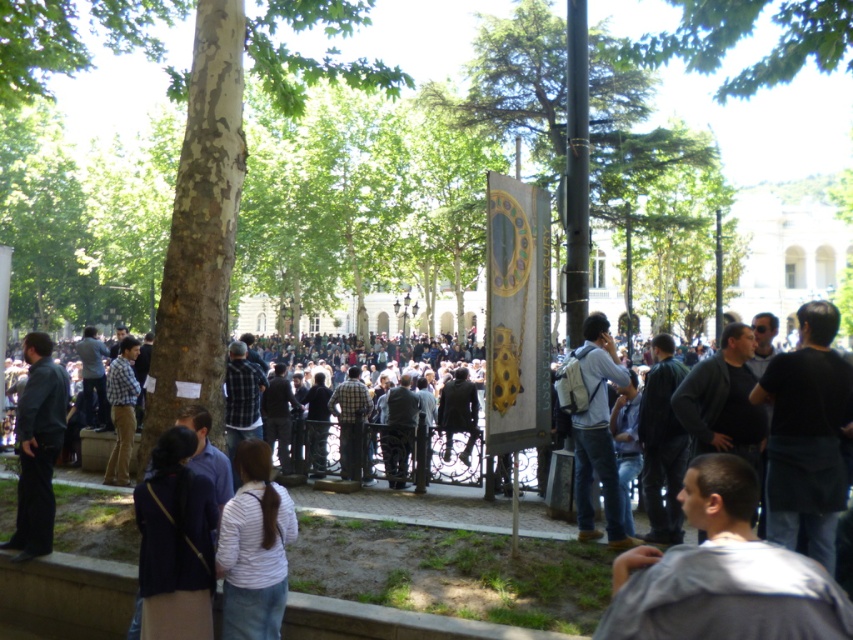
You are standing at the camera position and want to pick up the dark purple sweater at lower left. Can you reach it without moving from your current position?

The dark purple sweater at lower left and camera are 22.99 meters apart, so you cannot reach it without moving from your current position.

You are a photographer trying to capture both the dark purple sweater at lower left and the dark blue shirt at left in a single shot. Based on their positions, which one should you focus on first to ensure both are in frame?

The dark purple sweater at lower left is located below the dark blue shirt at left. To capture both in a single shot, focus on the dark blue shirt at left first since it is higher up, allowing the camera to include the lower positioned dark purple sweater at lower left in the frame.

You are standing at the center of the park and see two points marked in the image. Which point, point 1 at coordinates (183, 508) or point 2 at coordinates (50, 445), is closer to you?

Point 1 at coordinates (183, 508) is closer to you than point 2 at coordinates (50, 445).